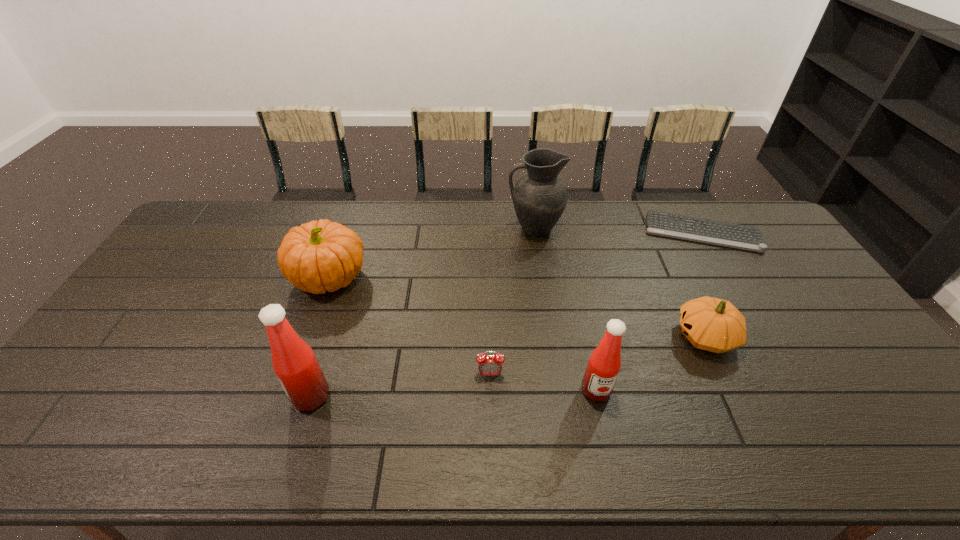
This screenshot has width=960, height=540. I want to click on vacant space located 0.090m on the side of the fifth tallest object with the carved face, so click(642, 336).

Image resolution: width=960 pixels, height=540 pixels. What are the coordinates of `free location located 0.080m on the face of the fifth object from right to left` in the screenshot? It's located at (491, 407).

Where is `computer keyboard located in the far edge section of the desktop`? This screenshot has width=960, height=540. computer keyboard located in the far edge section of the desktop is located at coordinates (744, 237).

Locate an element on the screen. pitcher that is at the far edge is located at coordinates click(x=539, y=197).

What are the coordinates of `object present at the right edge` in the screenshot? It's located at (744, 237).

Identify the location of object that is at the far right corner. The width and height of the screenshot is (960, 540). tap(744, 237).

Find the location of a particular element. vacant space at the far edge of the desktop is located at coordinates (389, 218).

This screenshot has height=540, width=960. Find the location of `vacant space at the near edge of the desktop`. vacant space at the near edge of the desktop is located at coordinates pos(478,403).

Locate an element on the screen. vacant space at the left edge of the desktop is located at coordinates (216, 250).

Image resolution: width=960 pixels, height=540 pixels. In the image, there is a desktop. Identify the location of vacant region at the right edge. (787, 287).